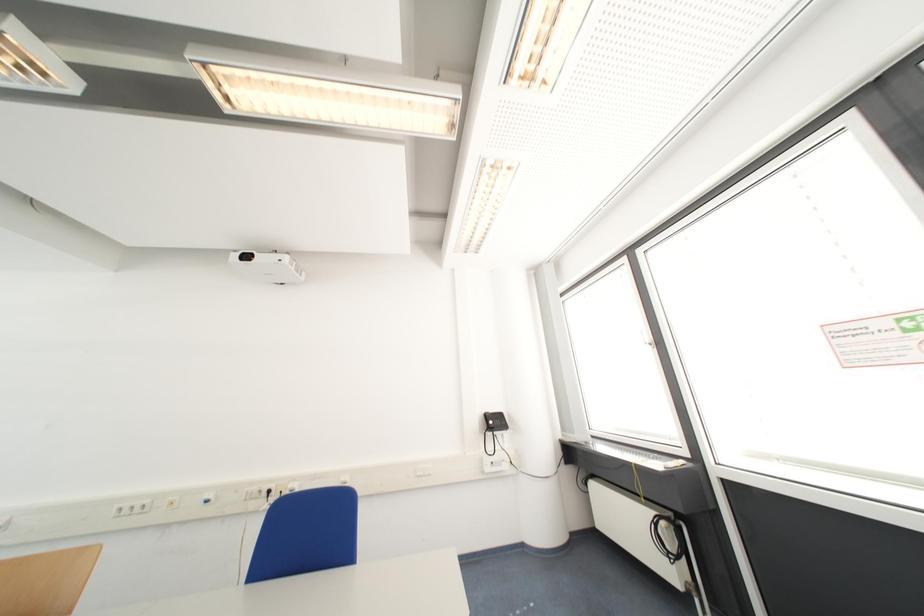
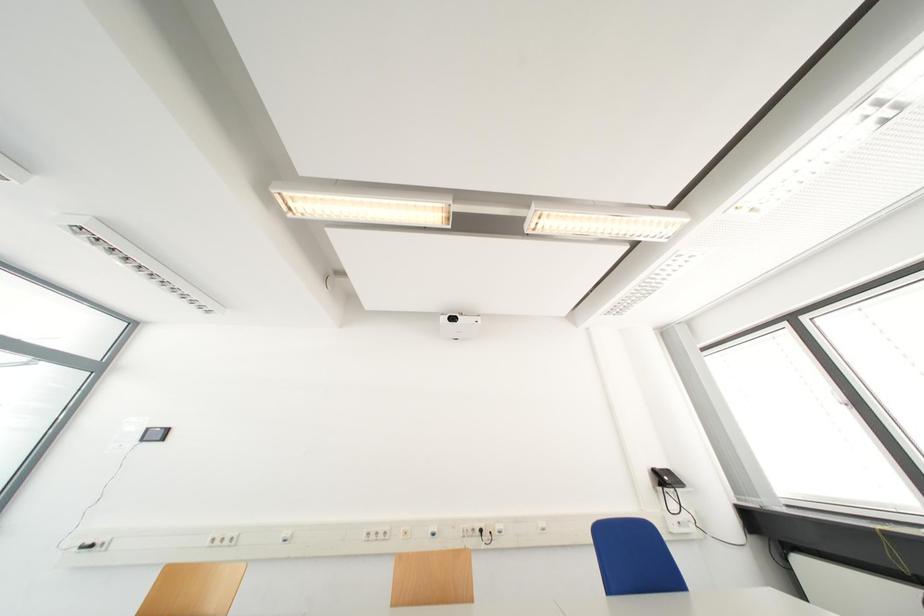
Which direction would the cameraman need to move to produce the second image?

The movement direction of the cameraman is left, backward.